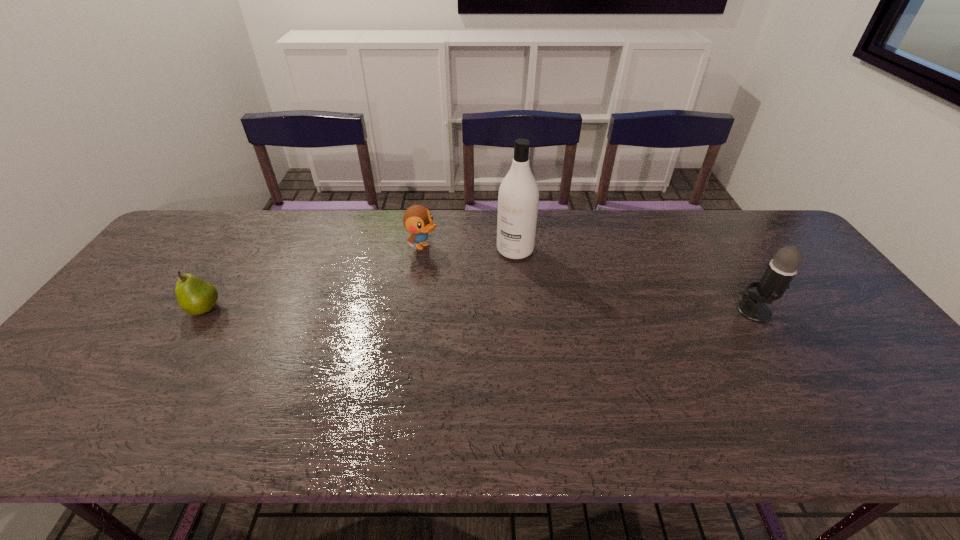
What are the coordinates of `pear` in the screenshot? It's located at pyautogui.click(x=195, y=296).

This screenshot has height=540, width=960. What are the coordinates of `the rightmost object` in the screenshot? It's located at (781, 270).

Where is `the second tallest object`? the second tallest object is located at coordinates (781, 270).

Where is `duck`? The height and width of the screenshot is (540, 960). duck is located at coordinates (418, 220).

Locate an element on the screen. The image size is (960, 540). the second object from right to left is located at coordinates (518, 198).

Identify the location of the tallest object. This screenshot has width=960, height=540. (518, 198).

Image resolution: width=960 pixels, height=540 pixels. Identify the location of free region located on the right of the pear. (302, 309).

At what (x,y) coordinates should I click in order to perform the action: click on free space located on the right of the microphone. Please return your answer as a coordinate pair (x, y). This screenshot has height=540, width=960. Looking at the image, I should click on (829, 312).

At what (x,y) coordinates should I click in order to perform the action: click on vacant space located on the front-facing side of the duck. Please return your answer as a coordinate pair (x, y). Image resolution: width=960 pixels, height=540 pixels. Looking at the image, I should click on (468, 268).

This screenshot has width=960, height=540. In order to click on free space located on the front-facing side of the duck in this screenshot , I will do `click(527, 298)`.